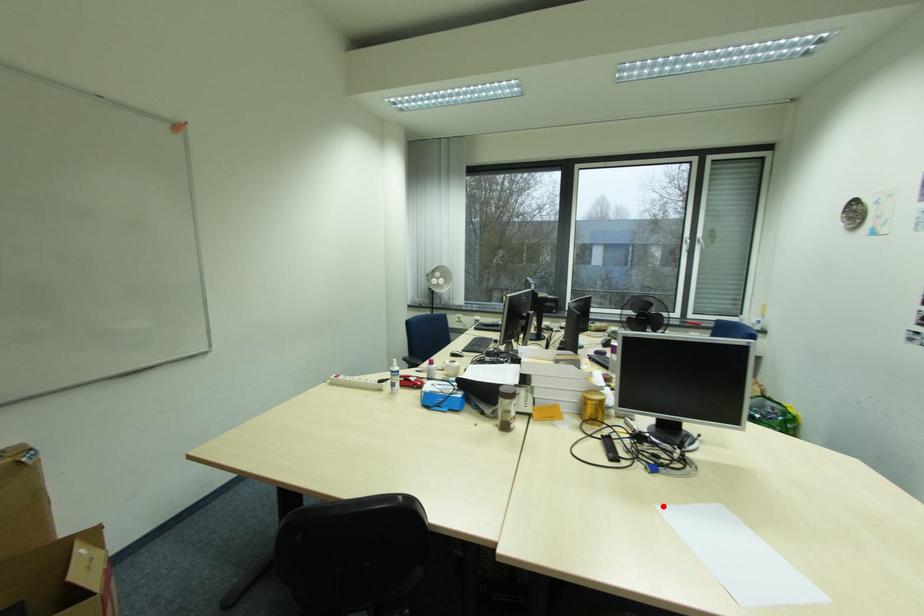
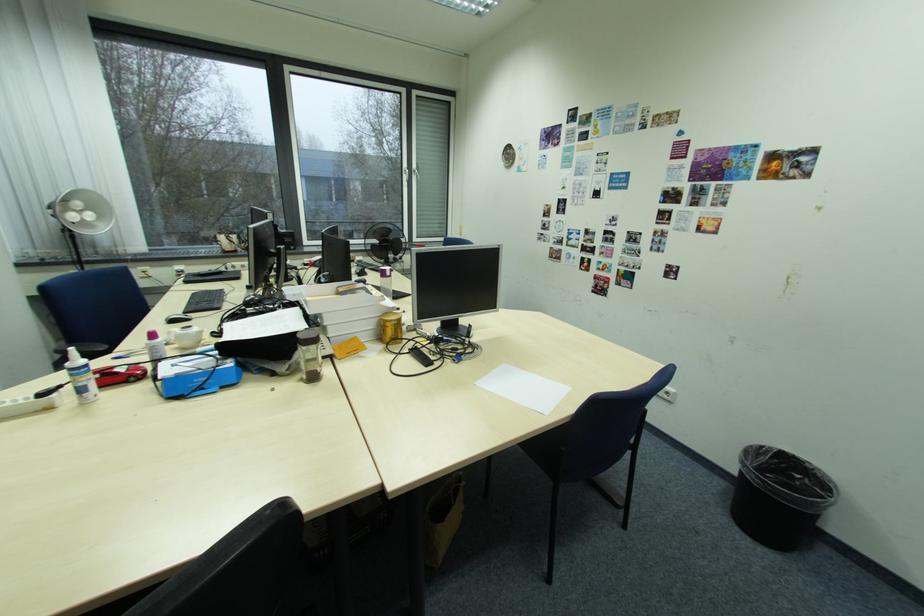
In the second image, find the point that corresponds to the highlighted location in the first image.

(482, 384)